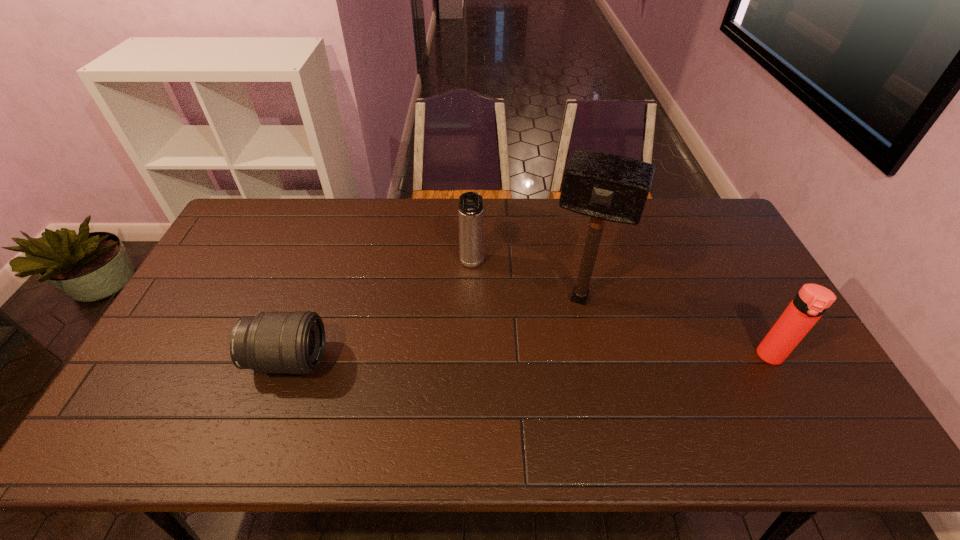
Find the location of a particular element. The image size is (960, 540). telephoto lens is located at coordinates (271, 342).

Identify the location of the leftmost object. Image resolution: width=960 pixels, height=540 pixels. (271, 342).

This screenshot has width=960, height=540. In order to click on the right thermos bottle in this screenshot , I will do `click(812, 301)`.

The image size is (960, 540). I want to click on the nearer thermos bottle, so click(x=812, y=301).

Find the location of a particular element. This screenshot has width=960, height=540. the farther thermos bottle is located at coordinates (471, 234).

Locate an element on the screen. the second object from left to right is located at coordinates (471, 234).

The image size is (960, 540). I want to click on mallet, so click(x=607, y=187).

This screenshot has width=960, height=540. Identify the location of the third nearest object. (607, 187).

The width and height of the screenshot is (960, 540). Find the location of `free spot located on the surface of the telephoto lens`. free spot located on the surface of the telephoto lens is located at coordinates tap(444, 360).

Locate an element on the screen. free space located on the back of the rightmost object is located at coordinates (731, 284).